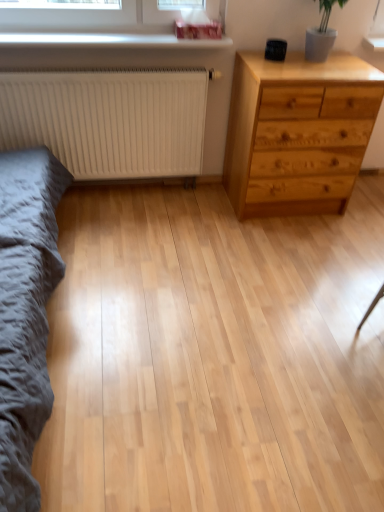
The image size is (384, 512). In order to click on free space between natural wood chest of drawers at right and white matte radiator at left in this screenshot , I will do (x=175, y=204).